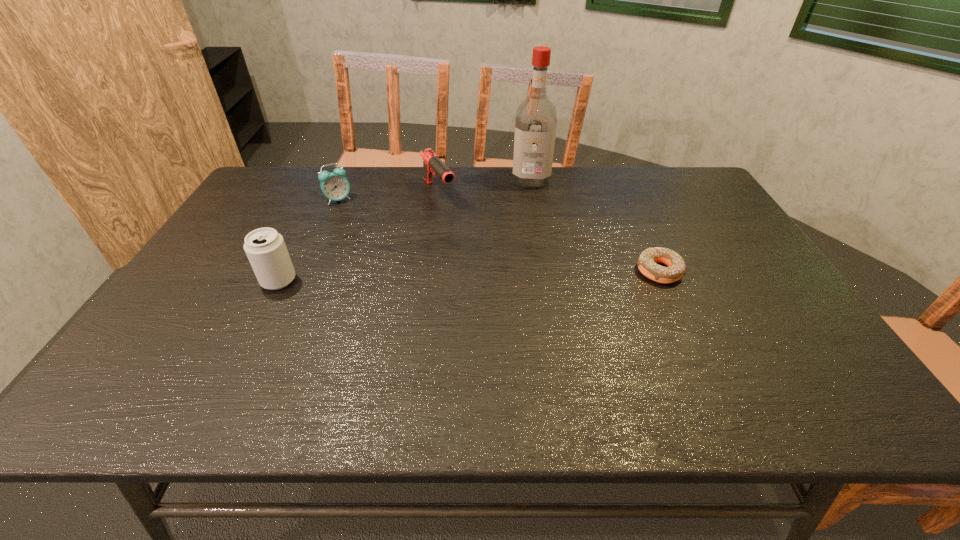
Where is `free space on the desktop that is between the can and the shortest object and is positioned at the aiming end of the gun`? The image size is (960, 540). free space on the desktop that is between the can and the shortest object and is positioned at the aiming end of the gun is located at coordinates (508, 275).

Where is `vacant space on the desktop that is between the can and the shortest object and is positioned on the front-facing side of the tallest object`? The image size is (960, 540). vacant space on the desktop that is between the can and the shortest object and is positioned on the front-facing side of the tallest object is located at coordinates (527, 274).

What are the coordinates of `vacant spot on the desktop that is between the can and the doughnut and is positioned on the face of the alarm clock` in the screenshot? It's located at 425,277.